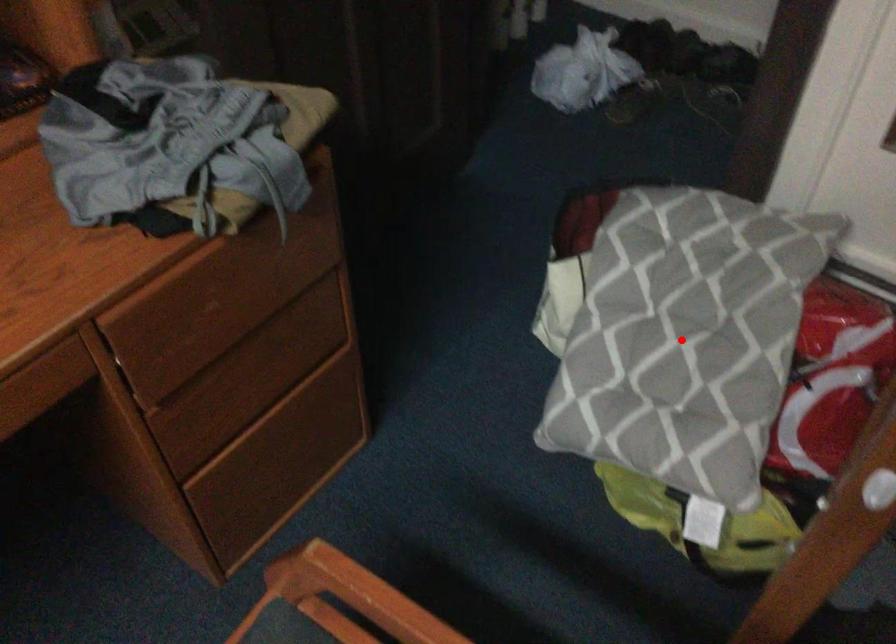
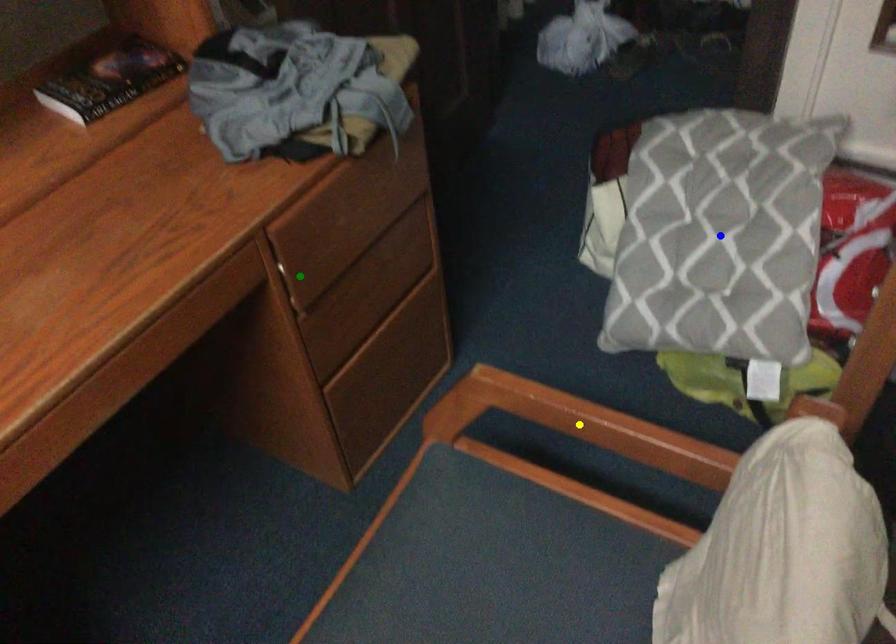
Question: I am providing you with two images of the same scene from different viewpoints. A red point is marked on the first image. You are given multiple points on the second image. Which point in image 2 is actually the same real-world point as the red point in image 1?

Choices:
 (A) blue point
 (B) green point
 (C) yellow point

Answer: (A)